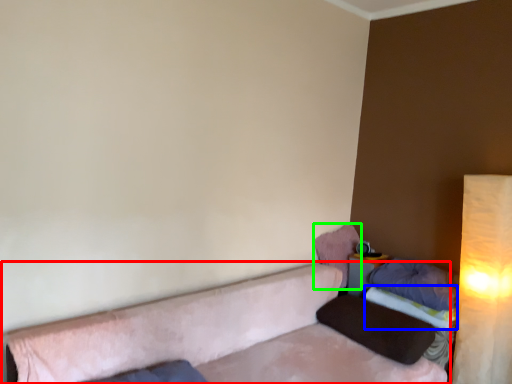
Question: Estimate the real-world distances between objects in this image. Which object is farther from studio couch (highlighted by a red box), sheet (highlighted by a blue box) or pillow (highlighted by a green box)?

Choices:
 (A) sheet
 (B) pillow

Answer: (A)